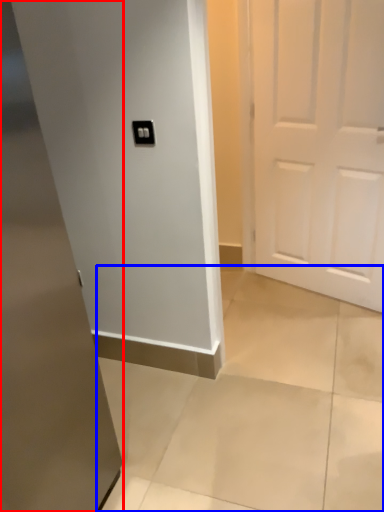
Question: Which object is closer to the camera taking this photo, door (highlighted by a red box) or concrete (highlighted by a blue box)?

Choices:
 (A) door
 (B) concrete

Answer: (A)